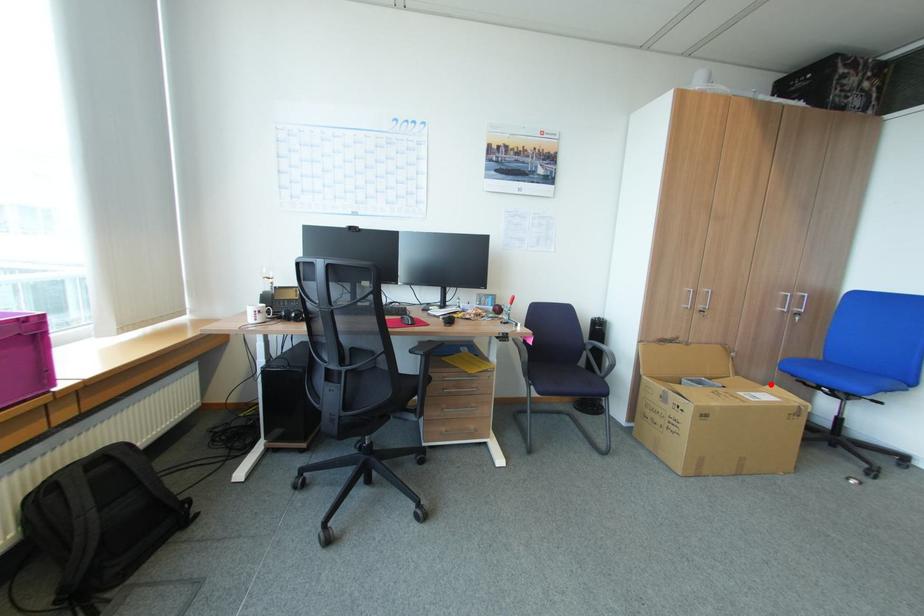
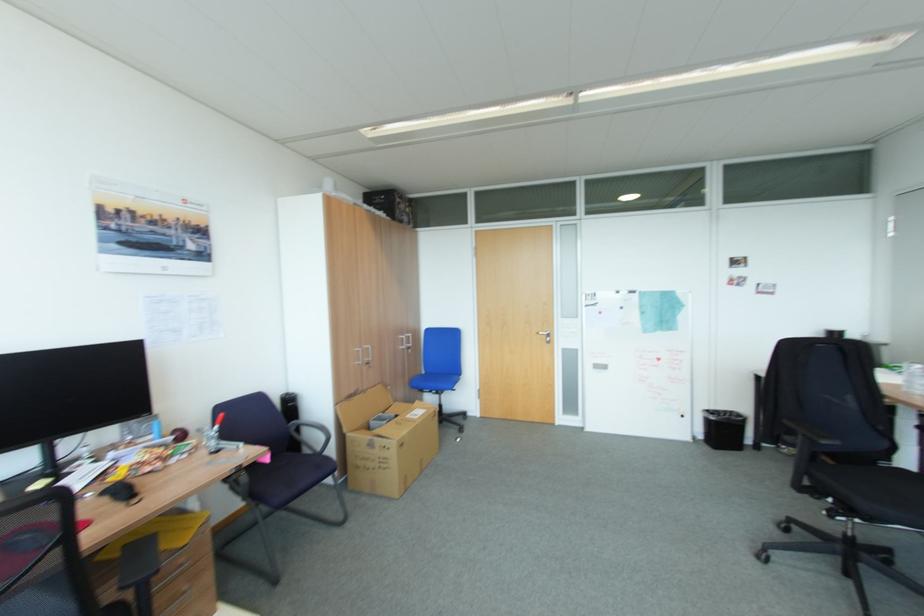
In the second image, find the point that corresponds to the highlighted location in the first image.

(419, 403)